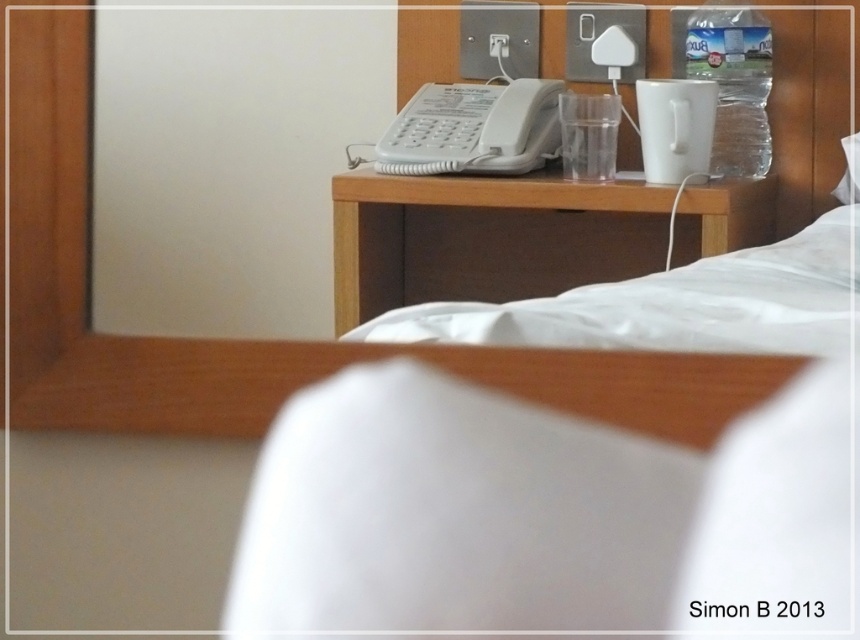
Where is `matte wooden mirror at upper center`? The height and width of the screenshot is (640, 860). matte wooden mirror at upper center is located at coordinates (243, 340).

Does white plastic phone at center have a lesser width compared to clear plastic bottle at upper right?

In fact, white plastic phone at center might be wider than clear plastic bottle at upper right.

Is white plastic phone at center bigger than clear plastic bottle at upper right?

Indeed, white plastic phone at center has a larger size compared to clear plastic bottle at upper right.

Which is behind, point (412, 115) or point (720, 10)?

Positioned behind is point (412, 115).

Identify the location of white plastic phone at center. Image resolution: width=860 pixels, height=640 pixels. (473, 129).

From the picture: Between white plastic phone at center and white plastic lamp at upper center, which one has less height?

With less height is white plastic phone at center.

What do you see at coordinates (473, 129) in the screenshot?
I see `white plastic phone at center` at bounding box center [473, 129].

Which is behind, point (412, 134) or point (615, 81)?

The point (615, 81) is behind.

Find the location of a particular element. Image resolution: width=860 pixels, height=640 pixels. white plastic phone at center is located at coordinates (473, 129).